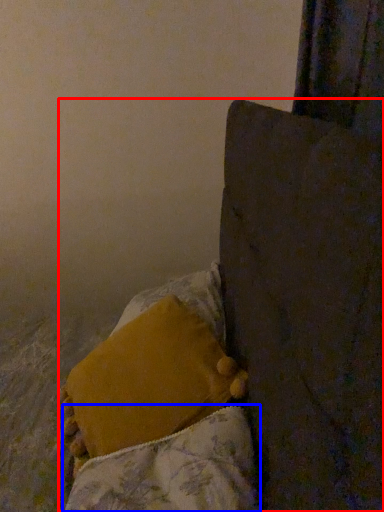
Question: Which of the following is the farthest to the observer, furniture (highlighted by a red box) or blanket (highlighted by a blue box)?

Choices:
 (A) furniture
 (B) blanket

Answer: (B)